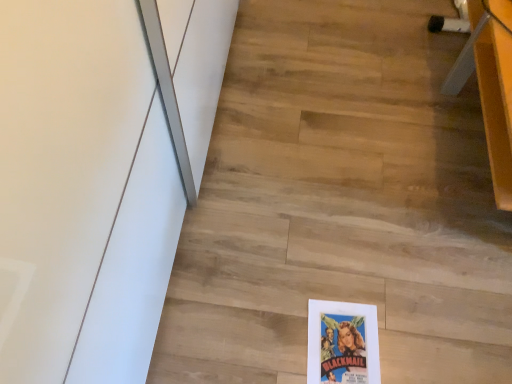
Where is `free area behind wooden desk at upper right`? The height and width of the screenshot is (384, 512). free area behind wooden desk at upper right is located at coordinates (403, 39).